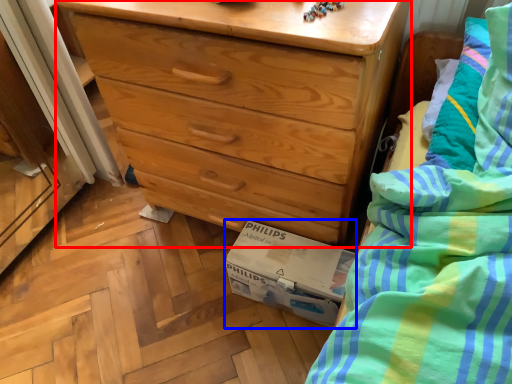
Question: Among these objects, which one is nearest to the camera, chest of drawers (highlighted by a red box) or cardboard box (highlighted by a blue box)?

Choices:
 (A) chest of drawers
 (B) cardboard box

Answer: (A)